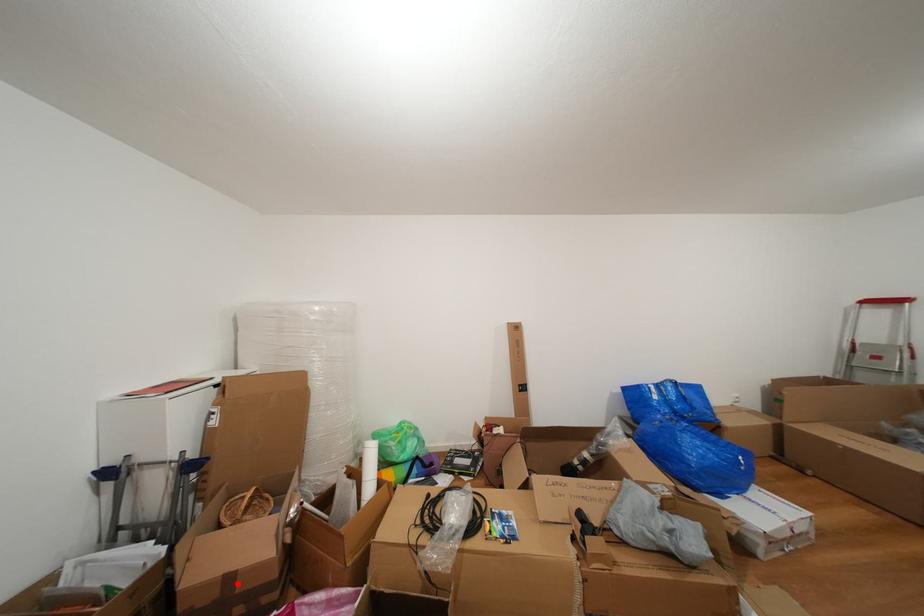
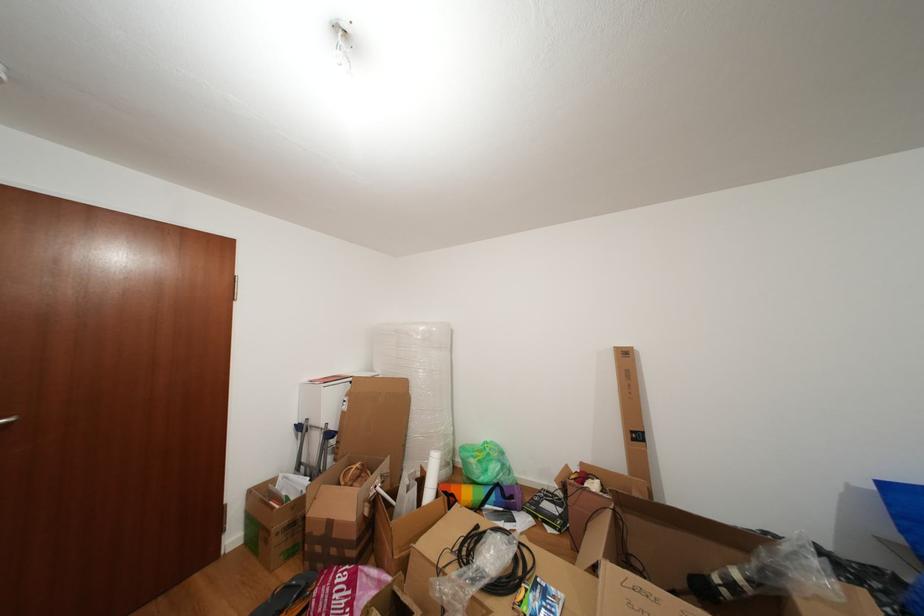
Question: I am providing you with two images of the same scene from different viewpoints. Given a red point in image1, look at the same physical point in image2. Is it:

Choices:
 (A) Closer to the viewpoint
 (B) Farther from the viewpoint

Answer: (B)